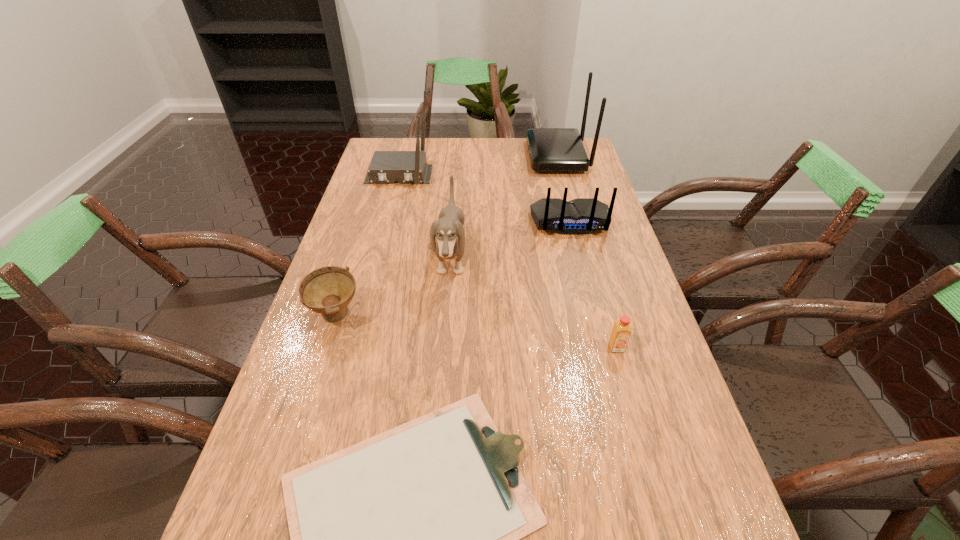
The width and height of the screenshot is (960, 540). Find the location of `vacant region located 0.300m on the right of the soup bowl`. vacant region located 0.300m on the right of the soup bowl is located at coordinates (488, 316).

Locate an element on the screen. The image size is (960, 540). free space located on the front and back of the second shortest object is located at coordinates click(625, 376).

You are a GUI agent. You are given a task and a screenshot of the screen. Output one action in this format:
    pyautogui.click(x=<x>, y=<y>)
    Task: Click on the router that is at the left edge
    The image size is (960, 540).
    Given the screenshot: What is the action you would take?
    pyautogui.click(x=386, y=166)

Where is `soup bowl that is at the left edge`? The height and width of the screenshot is (540, 960). soup bowl that is at the left edge is located at coordinates (x=328, y=290).

The width and height of the screenshot is (960, 540). What are the coordinates of `orange juice that is at the right edge` in the screenshot? It's located at (621, 331).

Locate an element on the screen. object located in the far left corner section of the desktop is located at coordinates (386, 166).

This screenshot has width=960, height=540. I want to click on object at the far right corner, so pyautogui.click(x=550, y=149).

In the image, there is a desktop. At what (x,y) coordinates should I click in order to perform the action: click on free space at the far edge. Please return your answer as a coordinate pair (x, y). This screenshot has width=960, height=540. Looking at the image, I should click on (455, 158).

The image size is (960, 540). I want to click on free space at the left edge of the desktop, so [374, 196].

This screenshot has width=960, height=540. Identify the location of vacant region at the right edge of the desktop. (601, 190).